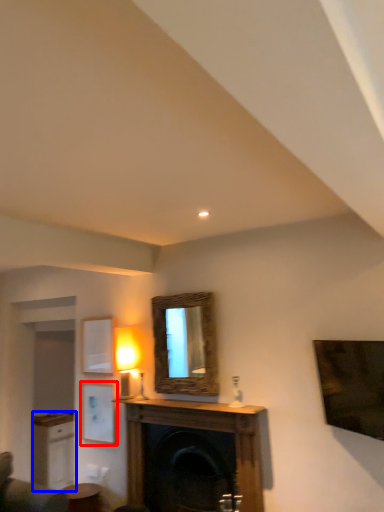
Question: Which object is further to the camera taking this photo, picture frame (highlighted by a red box) or cabinetry (highlighted by a blue box)?

Choices:
 (A) picture frame
 (B) cabinetry

Answer: (B)